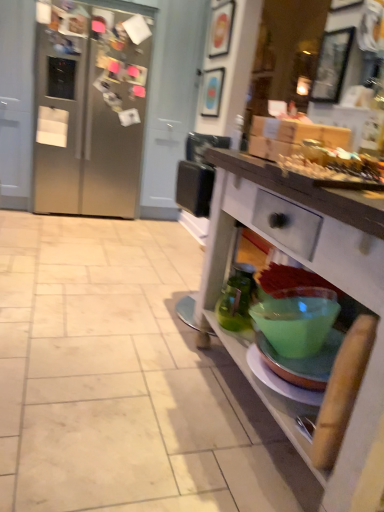
Question: Should I look upward or downward to see wooden picture frame at upper center, acting as the 2th picture frame starting from the right?

Choices:
 (A) up
 (B) down

Answer: (A)

Question: Could you tell me if satin silver refrigerator at left is turned towards matte blue picture frame at upper center, the 1th picture frame from the back?

Choices:
 (A) yes
 (B) no

Answer: (B)

Question: From a real-world perspective, is satin silver refrigerator at left on matte blue picture frame at upper center, the 1th picture frame from the back?

Choices:
 (A) yes
 (B) no

Answer: (B)

Question: Is satin silver refrigerator at left not close to matte blue picture frame at upper center, the 2th picture frame positioned from the bottom?

Choices:
 (A) no
 (B) yes

Answer: (A)

Question: Is satin silver refrigerator at left at the right side of matte blue picture frame at upper center, which appears as the 2th picture frame when viewed from the top?

Choices:
 (A) no
 (B) yes

Answer: (A)

Question: From the image's perspective, is satin silver refrigerator at left located beneath matte blue picture frame at upper center, the 3th picture frame positioned from the right?

Choices:
 (A) yes
 (B) no

Answer: (A)

Question: Is satin silver refrigerator at left wider than matte blue picture frame at upper center, marked as the third picture frame in a front-to-back arrangement?

Choices:
 (A) yes
 (B) no

Answer: (A)

Question: Is wooden picture frame at upper right, which is the 3th picture frame in left-to-right order, to the left of satin silver refrigerator at left from the viewer's perspective?

Choices:
 (A) no
 (B) yes

Answer: (A)

Question: Considering the relative sizes of wooden picture frame at upper right, the first picture frame ordered from the bottom, and satin silver refrigerator at left in the image provided, is wooden picture frame at upper right, the first picture frame ordered from the bottom, shorter than satin silver refrigerator at left?

Choices:
 (A) yes
 (B) no

Answer: (A)

Question: From a real-world perspective, is wooden picture frame at upper right, placed as the first picture frame when sorted from right to left, beneath satin silver refrigerator at left?

Choices:
 (A) yes
 (B) no

Answer: (B)

Question: Is wooden picture frame at upper right, placed as the first picture frame when sorted from front to back, beside satin silver refrigerator at left?

Choices:
 (A) yes
 (B) no

Answer: (B)

Question: Is wooden picture frame at upper right, placed as the first picture frame when sorted from front to back, not inside satin silver refrigerator at left?

Choices:
 (A) yes
 (B) no

Answer: (A)

Question: Is wooden picture frame at upper right, the 3th picture frame when ordered from back to front, behind satin silver refrigerator at left?

Choices:
 (A) yes
 (B) no

Answer: (B)

Question: Can you confirm if matte blue picture frame at upper center, the 3th picture frame positioned from the right, is wider than wooden picture frame at upper center, the 3th picture frame ordered from the bottom?

Choices:
 (A) yes
 (B) no

Answer: (B)